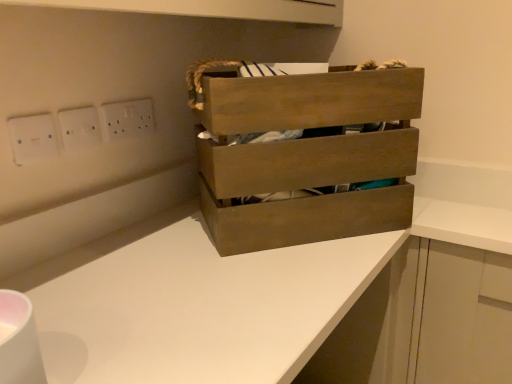
This screenshot has height=384, width=512. I want to click on vacant region in front of wooden crate at center, so click(256, 284).